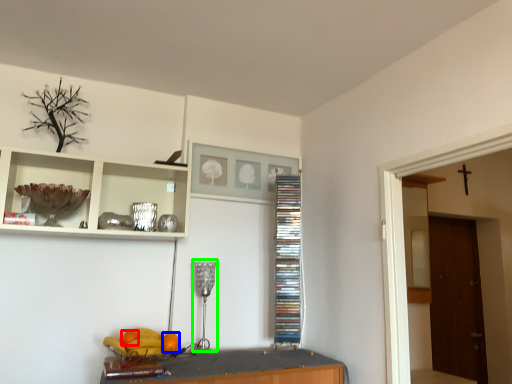
Question: Which object is positioned farthest from orange (highlighted by a red box)? Select from orange (highlighted by a blue box) and lamp (highlighted by a green box).

Choices:
 (A) orange
 (B) lamp

Answer: (B)